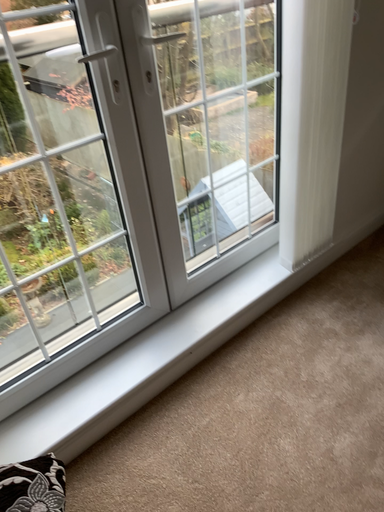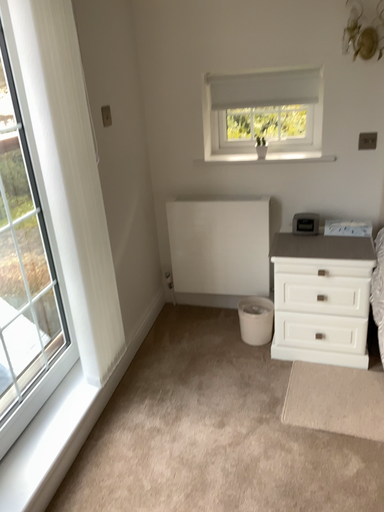
Question: How did the camera likely rotate when shooting the video?

Choices:
 (A) rotated upward
 (B) rotated downward

Answer: (A)